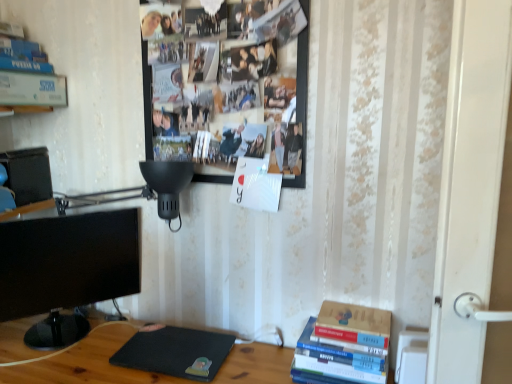
Question: From a real-world perspective, is hardcover books at lower right positioned under black glossy monitor at left based on gravity?

Choices:
 (A) no
 (B) yes

Answer: (B)

Question: From the image's perspective, is hardcover books at lower right beneath black glossy monitor at left?

Choices:
 (A) no
 (B) yes

Answer: (B)

Question: Is hardcover books at lower right positioned beyond the bounds of black glossy monitor at left?

Choices:
 (A) yes
 (B) no

Answer: (A)

Question: Is hardcover books at lower right far from black glossy monitor at left?

Choices:
 (A) yes
 (B) no

Answer: (B)

Question: Is hardcover books at lower right shorter than black glossy monitor at left?

Choices:
 (A) yes
 (B) no

Answer: (A)

Question: Which is correct: black glossy monitor at left is inside black matte laptop at lower center, or outside of it?

Choices:
 (A) inside
 (B) outside

Answer: (B)

Question: In the image, is black glossy monitor at left on the left side or the right side of black matte laptop at lower center?

Choices:
 (A) right
 (B) left

Answer: (B)

Question: Is black glossy monitor at left in front of or behind black matte laptop at lower center in the image?

Choices:
 (A) front
 (B) behind

Answer: (B)

Question: From the image's perspective, is black glossy monitor at left positioned above or below black matte laptop at lower center?

Choices:
 (A) above
 (B) below

Answer: (A)

Question: In terms of size, does black glossy monitor at left appear bigger or smaller than wooden photo frame at upper center?

Choices:
 (A) small
 (B) big

Answer: (A)

Question: From the image's perspective, is black glossy monitor at left positioned above or below wooden photo frame at upper center?

Choices:
 (A) above
 (B) below

Answer: (B)

Question: Is black glossy monitor at left wider or thinner than wooden photo frame at upper center?

Choices:
 (A) wide
 (B) thin

Answer: (A)

Question: Visually, is black glossy monitor at left positioned to the left or to the right of wooden photo frame at upper center?

Choices:
 (A) left
 (B) right

Answer: (A)

Question: From a real-world perspective, relative to hardcover books at lower right, is black glossy monitor at left vertically above or below?

Choices:
 (A) below
 (B) above

Answer: (B)

Question: Looking at the image, does black glossy monitor at left seem bigger or smaller compared to hardcover books at lower right?

Choices:
 (A) big
 (B) small

Answer: (A)